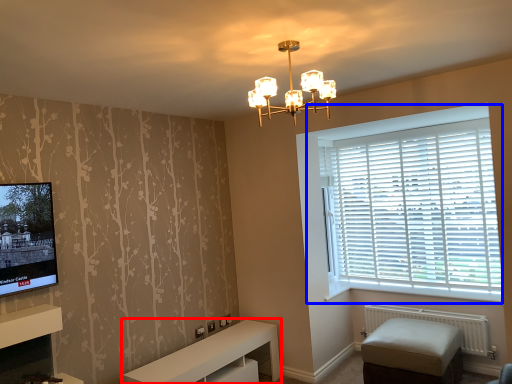
Question: Among these objects, which one is farthest to the camera, furniture (highlighted by a red box) or window (highlighted by a blue box)?

Choices:
 (A) furniture
 (B) window

Answer: (B)